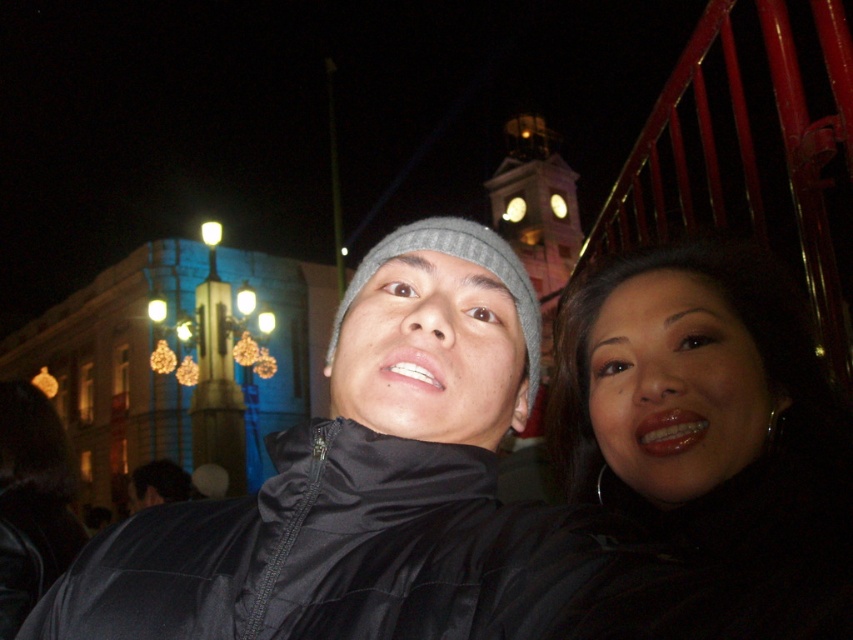
Where is `black matte jacket at center`? black matte jacket at center is located at coordinates (334, 454).

Who is lower down, black matte jacket at center or matte black jacket at lower right?

black matte jacket at center is lower down.

Does point (402, 392) come farther from viewer compared to point (817, 584)?

Yes, it is behind point (817, 584).

The image size is (853, 640). In order to click on black matte jacket at center in this screenshot , I will do `click(334, 454)`.